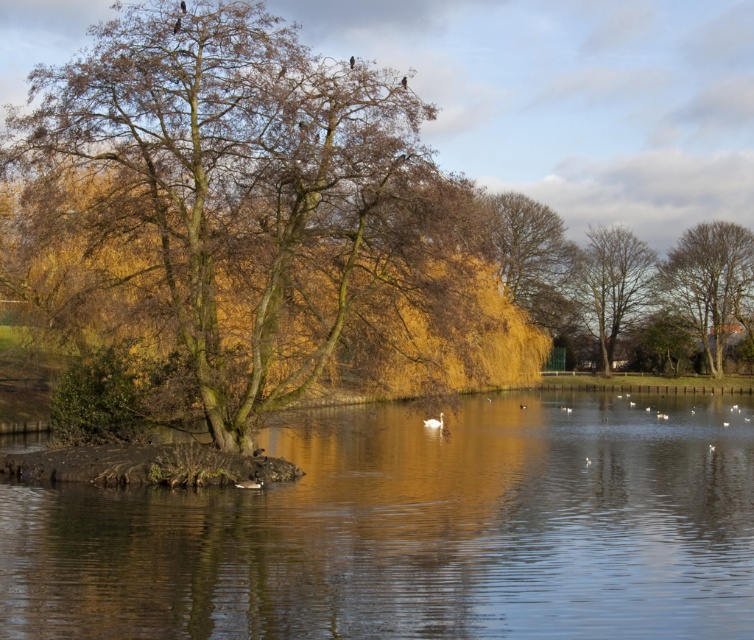
Question: Observing the image, what is the correct spatial positioning of brown leafy tree at center in reference to bare branches tree at right?

Choices:
 (A) right
 (B) left

Answer: (B)

Question: Which point is farther to the camera?

Choices:
 (A) brown feathered bird at upper center
 (B) brown leafy tree at center
 (C) brown leafy tree at right
 (D) white matte duck at center

Answer: (C)

Question: Observing the image, what is the correct spatial positioning of brown leafy tree at center in reference to clear water at center?

Choices:
 (A) below
 (B) above

Answer: (B)

Question: Which point is farther to the camera?

Choices:
 (A) (225, 275)
 (B) (176, 26)

Answer: (A)

Question: Can you confirm if brown leafy tree at right is thinner than brown feathered bird at upper center?

Choices:
 (A) no
 (B) yes

Answer: (A)

Question: Among these objects, which one is farthest from the camera?

Choices:
 (A) bare branches tree at right
 (B) brown leafy tree at center
 (C) white matte duck at center

Answer: (A)